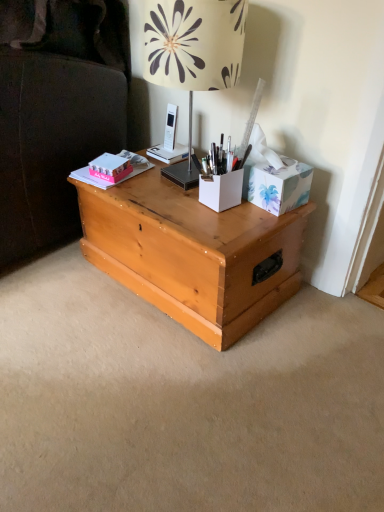
Question: From the image's perspective, is light wood trunk at center above or below beige floral lampshade at upper center?

Choices:
 (A) below
 (B) above

Answer: (A)

Question: In terms of size, does light wood trunk at center appear bigger or smaller than beige floral lampshade at upper center?

Choices:
 (A) small
 (B) big

Answer: (B)

Question: Considering the real-world distances, which object is closest to the pink matte book at upper left?

Choices:
 (A) light wood trunk at center
 (B) beige floral lampshade at upper center
 (C) floral-patterned cardboard tissue box at upper right, the first cardboard box positioned from the right
 (D) white matte pen holder at center, the first cardboard box in the left-to-right sequence
 (E) pink matte box at upper left

Answer: (E)

Question: Estimate the real-world distances between objects in this image. Which object is closer to the white matte pen holder at center, the first cardboard box in the left-to-right sequence?

Choices:
 (A) pink matte box at upper left
 (B) pink matte book at upper left
 (C) beige floral lampshade at upper center
 (D) light wood trunk at center
 (E) floral-patterned cardboard tissue box at upper right, the first cardboard box positioned from the right

Answer: (E)